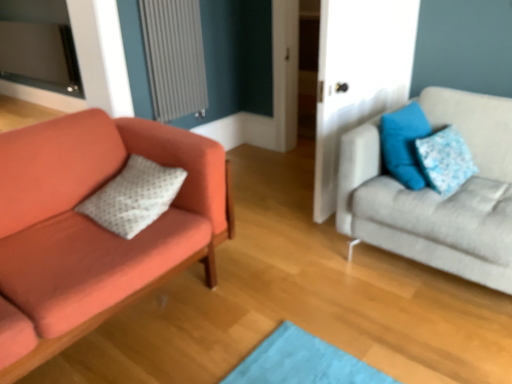
Where is `matte orange couch at left, the second studio couch from the right`? matte orange couch at left, the second studio couch from the right is located at coordinates (96, 225).

How much space does white dotted pillow at left, which appears as the third pillow when viewed from the right, occupy vertically?

The height of white dotted pillow at left, which appears as the third pillow when viewed from the right, is 7.71 inches.

What do you see at coordinates (437, 194) in the screenshot? The width and height of the screenshot is (512, 384). I see `light gray fabric couch at right, which is counted as the second studio couch, starting from the left` at bounding box center [437, 194].

What is the approximate width of gray textured radiator at upper left?

gray textured radiator at upper left is 3.12 inches wide.

This screenshot has width=512, height=384. What are the coordinates of `matte orange couch at left, which is the first studio couch in left-to-right order` in the screenshot? It's located at (96, 225).

This screenshot has width=512, height=384. In order to click on the 1st pillow above the matte orange couch at left, the second studio couch from the right (from a real-world perspective) in this screenshot , I will do `click(134, 196)`.

Considering the sizes of objects white dotted pillow at left, the first pillow viewed from the left, and matte orange couch at left, which is the first studio couch in left-to-right order, in the image provided, who is shorter, white dotted pillow at left, the first pillow viewed from the left, or matte orange couch at left, which is the first studio couch in left-to-right order,?

Standing shorter between the two is white dotted pillow at left, the first pillow viewed from the left.

Which point is more distant from viewer, (160,175) or (54,340)?

The point (160,175) is farther.

Is white dotted pillow at left, which appears as the third pillow when viewed from the right, located outside matte orange couch at left, which is the first studio couch in left-to-right order?

That's incorrect, white dotted pillow at left, which appears as the third pillow when viewed from the right, is not completely outside matte orange couch at left, which is the first studio couch in left-to-right order.

From the picture: Is gray textured radiator at upper left next to light gray fabric couch at right, which is counted as the second studio couch, starting from the left, and touching it?

No, gray textured radiator at upper left is not next to light gray fabric couch at right, which is counted as the second studio couch, starting from the left.

Image resolution: width=512 pixels, height=384 pixels. Identify the location of studio couch that is on the right side of gray textured radiator at upper left. (437, 194).

Who is smaller, gray textured radiator at upper left or light gray fabric couch at right, which is counted as the second studio couch, starting from the left?

gray textured radiator at upper left.

Locate an element on the screen. This screenshot has height=384, width=512. studio couch that appears on the right of gray textured radiator at upper left is located at coordinates (437, 194).

Does point (484, 106) appear closer or farther from the camera than point (172, 68)?

Point (484, 106).

Does light gray fabric couch at right, which is counted as the second studio couch, starting from the left, appear on the right side of gray textured radiator at upper left?

Indeed, light gray fabric couch at right, which is counted as the second studio couch, starting from the left, is positioned on the right side of gray textured radiator at upper left.

How many degrees apart are the facing directions of light gray fabric couch at right, which is counted as the second studio couch, starting from the left, and gray textured radiator at upper left?

84.4 degrees separate the facing orientations of light gray fabric couch at right, which is counted as the second studio couch, starting from the left, and gray textured radiator at upper left.

Would you say light gray fabric couch at right, which is counted as the second studio couch, starting from the left, is inside or outside matte orange couch at left, which is the first studio couch in left-to-right order?

light gray fabric couch at right, which is counted as the second studio couch, starting from the left, lies outside matte orange couch at left, which is the first studio couch in left-to-right order.

Does point (460, 255) appear closer or farther from the camera than point (112, 236)?

Point (460, 255) is farther from the camera than point (112, 236).

At what (x,y) coordinates should I click in order to perform the action: click on studio couch below the light gray fabric couch at right, which ranks as the 1th studio couch in right-to-left order (from the image's perspective). Please return your answer as a coordinate pair (x, y). The height and width of the screenshot is (384, 512). Looking at the image, I should click on (96, 225).

From a real-world perspective, which object stands above the other?

From a 3D spatial view, matte orange couch at left, which is the first studio couch in left-to-right order, is above.

Is white dotted pillow at left, the first pillow viewed from the left, facing away from blue fabric pillow at upper right, placed as the 2th pillow when sorted from right to left?

white dotted pillow at left, the first pillow viewed from the left, does not have its back to blue fabric pillow at upper right, placed as the 2th pillow when sorted from right to left.

Find the location of a particular element. This screenshot has width=512, height=384. pillow that is the 2nd one when counting backward from the white dotted pillow at left, which appears as the third pillow when viewed from the right is located at coordinates (404, 144).

Would you say white dotted pillow at left, the first pillow viewed from the left, is inside or outside blue fabric pillow at upper right, placed as the 2th pillow when sorted from right to left?

white dotted pillow at left, the first pillow viewed from the left, cannot be found inside blue fabric pillow at upper right, placed as the 2th pillow when sorted from right to left.

Between blue fabric pillow at upper right, positioned as the first pillow in right-to-left order, and matte orange couch at left, which is the first studio couch in left-to-right order, which one is positioned in front?

matte orange couch at left, which is the first studio couch in left-to-right order, is closer to the camera.

How many degrees apart are the facing directions of blue fabric pillow at upper right, which ranks as the third pillow in left-to-right order, and matte orange couch at left, the second studio couch from the right?

0.824 degrees.

Is blue fabric pillow at upper right, which ranks as the third pillow in left-to-right order, next to matte orange couch at left, the second studio couch from the right?

No, blue fabric pillow at upper right, which ranks as the third pillow in left-to-right order, is not touching matte orange couch at left, the second studio couch from the right.

Locate an element on the screen. studio couch that is the 1st object directly below the blue fabric pillow at upper right, positioned as the first pillow in right-to-left order (from a real-world perspective) is located at coordinates (96, 225).

Which of these two, blue fabric pillow at upper right, placed as the 2th pillow when sorted from left to right, or matte orange couch at left, the second studio couch from the right, stands shorter?

blue fabric pillow at upper right, placed as the 2th pillow when sorted from left to right.

Does blue fabric pillow at upper right, placed as the 2th pillow when sorted from right to left, have a smaller size compared to matte orange couch at left, the second studio couch from the right?

Indeed, blue fabric pillow at upper right, placed as the 2th pillow when sorted from right to left, has a smaller size compared to matte orange couch at left, the second studio couch from the right.

Considering the relative sizes of blue fabric pillow at upper right, placed as the 2th pillow when sorted from right to left, and matte orange couch at left, which is the first studio couch in left-to-right order, in the image provided, is blue fabric pillow at upper right, placed as the 2th pillow when sorted from right to left, wider than matte orange couch at left, which is the first studio couch in left-to-right order,?

No, blue fabric pillow at upper right, placed as the 2th pillow when sorted from right to left, is not wider than matte orange couch at left, which is the first studio couch in left-to-right order.

Image resolution: width=512 pixels, height=384 pixels. Find the location of `studio couch on the left of the white dotted pillow at left, the first pillow viewed from the left`. studio couch on the left of the white dotted pillow at left, the first pillow viewed from the left is located at coordinates (96, 225).

From the image's perspective, count 1st studio couchs downward from the gray textured radiator at upper left and point to it. Please provide its 2D coordinates.

[(437, 194)]

Looking at the image, which one is located further to matte orange couch at left, which is the first studio couch in left-to-right order, blue fabric pillow at upper right, which ranks as the third pillow in left-to-right order, or gray textured radiator at upper left?

blue fabric pillow at upper right, which ranks as the third pillow in left-to-right order, is further to matte orange couch at left, which is the first studio couch in left-to-right order.

When comparing their distances from gray textured radiator at upper left, does blue fabric pillow at upper right, positioned as the first pillow in right-to-left order, or light gray fabric couch at right, which ranks as the 1th studio couch in right-to-left order, seem closer?

The object closer to gray textured radiator at upper left is light gray fabric couch at right, which ranks as the 1th studio couch in right-to-left order.

Consider the image. Which object lies nearer to the anchor point white dotted pillow at left, which appears as the third pillow when viewed from the right, blue fabric pillow at upper right, placed as the 2th pillow when sorted from left to right, or blue fabric pillow at upper right, which ranks as the third pillow in left-to-right order?

blue fabric pillow at upper right, placed as the 2th pillow when sorted from left to right, is positioned closer to the anchor white dotted pillow at left, which appears as the third pillow when viewed from the right.

Estimate the real-world distances between objects in this image. Which object is closer to light gray fabric couch at right, which ranks as the 1th studio couch in right-to-left order, gray textured radiator at upper left or blue fabric pillow at upper right, placed as the 2th pillow when sorted from right to left?

The object closer to light gray fabric couch at right, which ranks as the 1th studio couch in right-to-left order, is blue fabric pillow at upper right, placed as the 2th pillow when sorted from right to left.

Consider the image. From the image, which object appears to be farther from matte orange couch at left, which is the first studio couch in left-to-right order, gray textured radiator at upper left or light gray fabric couch at right, which ranks as the 1th studio couch in right-to-left order?

gray textured radiator at upper left is positioned further to the anchor matte orange couch at left, which is the first studio couch in left-to-right order.

Considering their positions, is white dotted pillow at left, the first pillow viewed from the left, positioned further to blue fabric pillow at upper right, placed as the 2th pillow when sorted from left to right, than blue fabric pillow at upper right, which ranks as the third pillow in left-to-right order?

white dotted pillow at left, the first pillow viewed from the left.

Which object lies further to the anchor point light gray fabric couch at right, which is counted as the second studio couch, starting from the left, gray textured radiator at upper left or matte orange couch at left, the second studio couch from the right?

The object further to light gray fabric couch at right, which is counted as the second studio couch, starting from the left, is gray textured radiator at upper left.

Considering their positions, is light gray fabric couch at right, which is counted as the second studio couch, starting from the left, positioned further to blue fabric pillow at upper right, positioned as the first pillow in right-to-left order, than blue fabric pillow at upper right, placed as the 2th pillow when sorted from right to left?

Based on the image, light gray fabric couch at right, which is counted as the second studio couch, starting from the left, appears to be further to blue fabric pillow at upper right, positioned as the first pillow in right-to-left order.

This screenshot has width=512, height=384. I want to click on pillow located between white dotted pillow at left, which appears as the third pillow when viewed from the right, and blue fabric pillow at upper right, positioned as the first pillow in right-to-left order, in the left-right direction, so click(x=404, y=144).

Identify the location of radiator between white dotted pillow at left, which appears as the third pillow when viewed from the right, and blue fabric pillow at upper right, positioned as the first pillow in right-to-left order, in the horizontal direction. (174, 57).

Where is `radiator between matte orange couch at left, the second studio couch from the right, and light gray fabric couch at right, which is counted as the second studio couch, starting from the left`? The image size is (512, 384). radiator between matte orange couch at left, the second studio couch from the right, and light gray fabric couch at right, which is counted as the second studio couch, starting from the left is located at coordinates coord(174,57).

The width and height of the screenshot is (512, 384). What are the coordinates of `pillow situated between matte orange couch at left, which is the first studio couch in left-to-right order, and blue fabric pillow at upper right, placed as the 2th pillow when sorted from right to left, from left to right` in the screenshot? It's located at (134, 196).